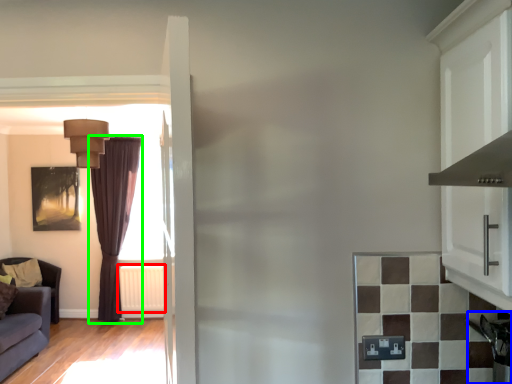
Question: Which is nearer to the radiator (highlighted by a red box)? appliance (highlighted by a blue box) or curtain (highlighted by a green box).

Choices:
 (A) appliance
 (B) curtain

Answer: (B)